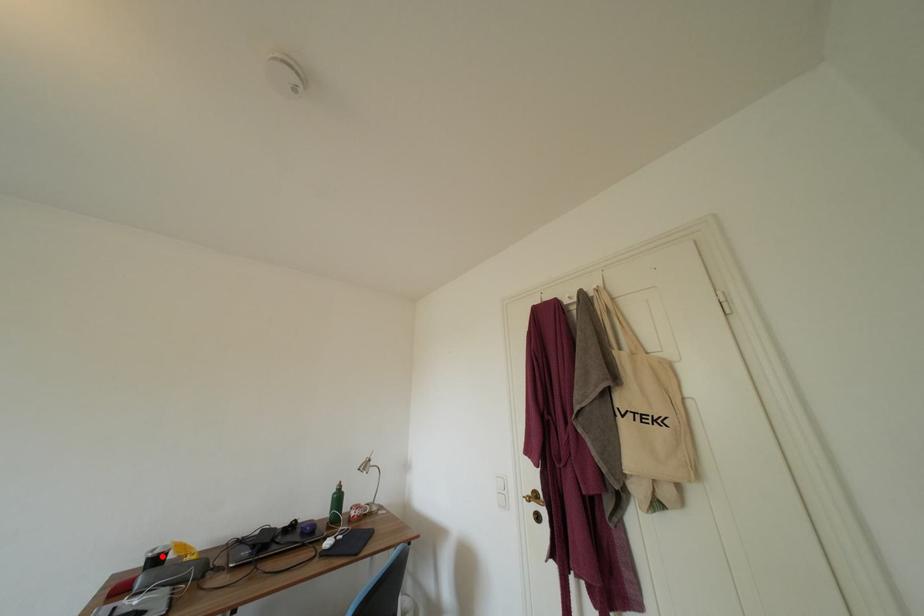
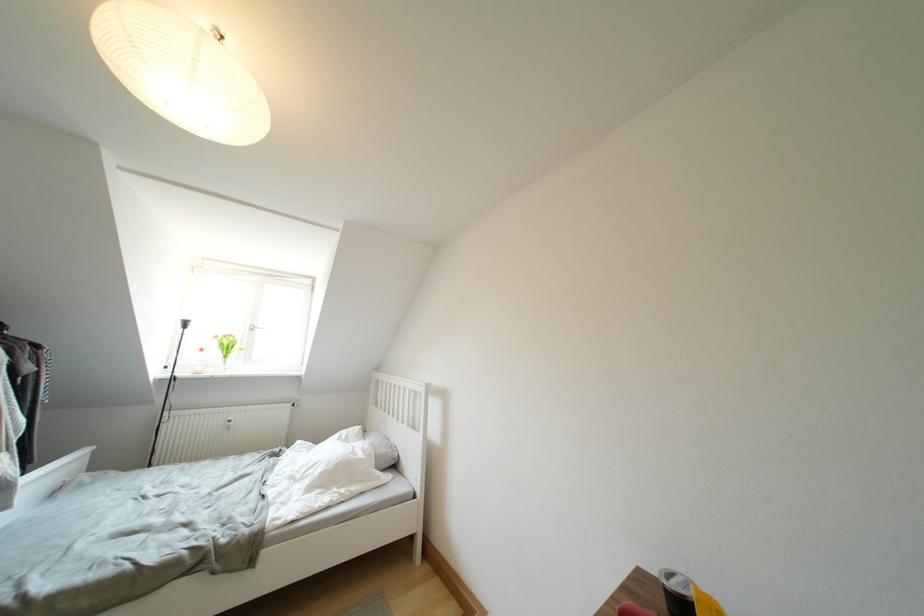
In the second image, find the point that corresponds to the highlighted location in the first image.

(678, 589)